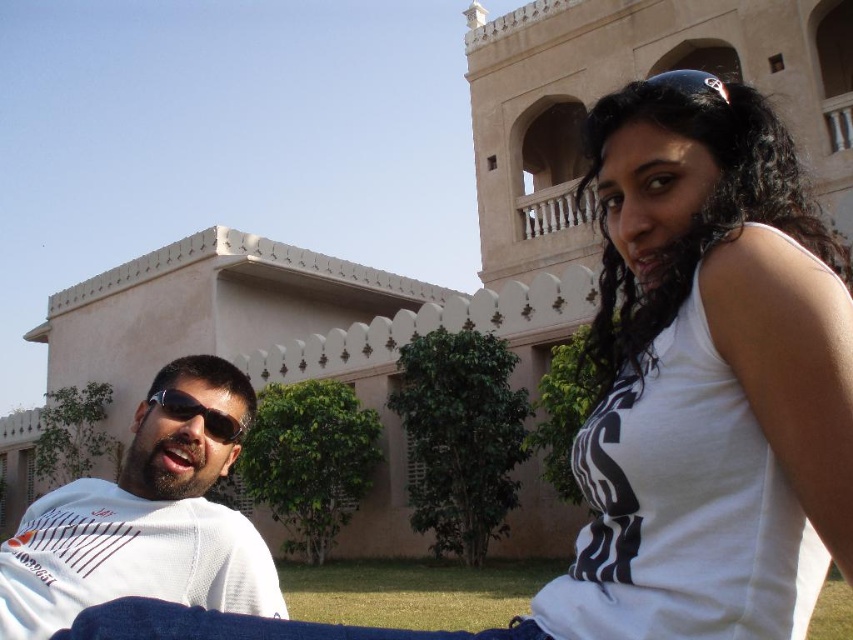
You are a photographer trying to capture a closeup of the white fabric shirt at left and the matte black sunglasses at left. Since you want both items to be in focus, which one should you position closer to the center of the frame?

The white fabric shirt at left should be positioned closer to the center of the frame because it is to the left of the matte black sunglasses at left, meaning it is farther away from the center. By moving it closer to the center, both items will be in focus.

You are standing at the point closest to the building in the image. Which of the two points, point (616, 102) or point (165, 381), is closer to you?

Point (165, 381) is closer to you because it is behind point (616, 102), which is in front of it.